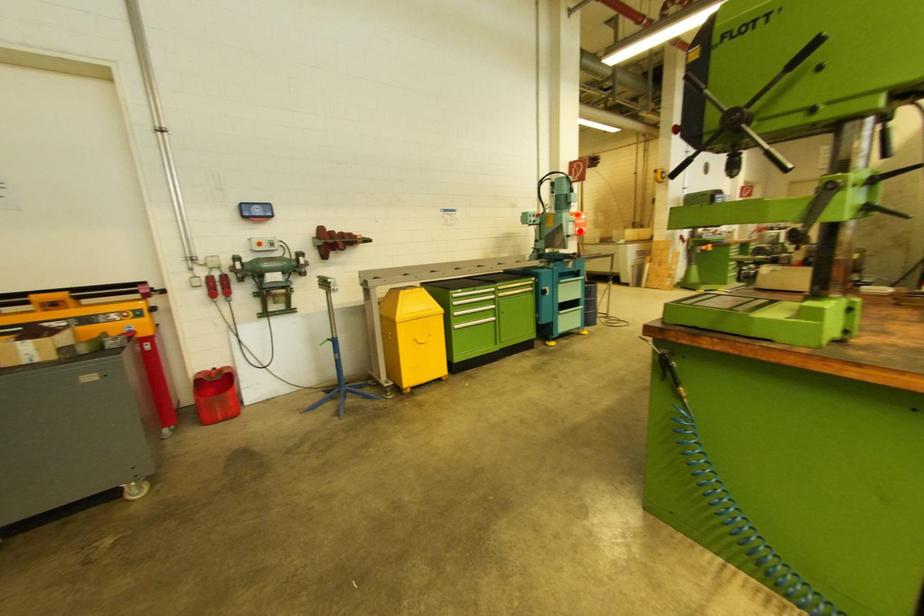
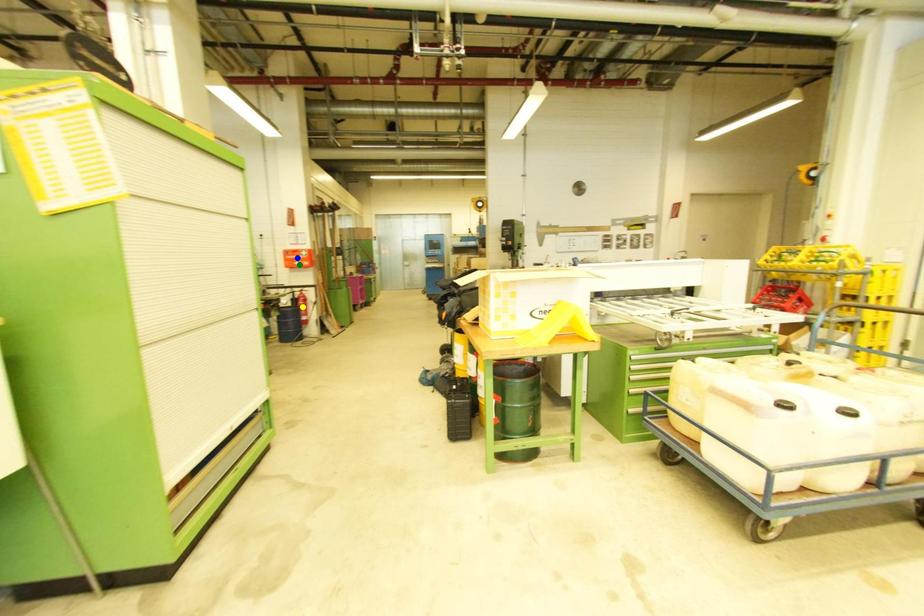
Question: I am providing you with two images of the same scene from different viewpoints. A red point is marked on the first image. You are given multiple points on the second image. Which point in image 2 represents the same 3d spot as the red point in image 1?

Choices:
 (A) yellow point
 (B) green point
 (C) blue point

Answer: (B)